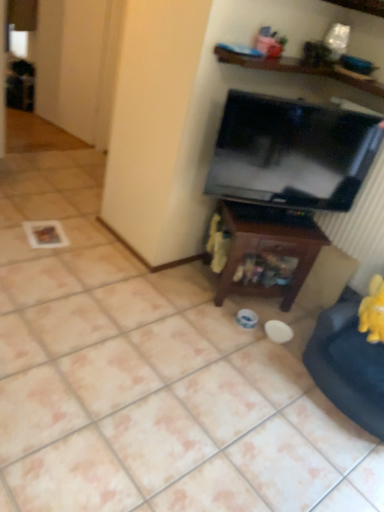
This screenshot has width=384, height=512. Find the location of `free space to the left of brown wood table at center`. free space to the left of brown wood table at center is located at coordinates (173, 284).